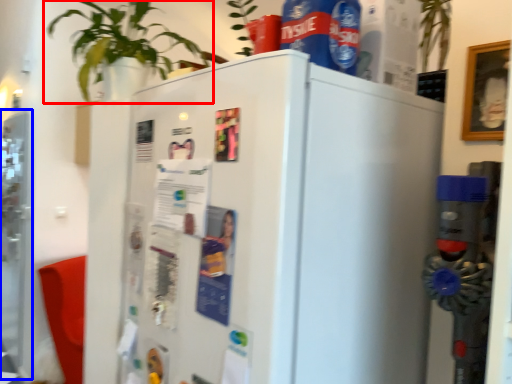
Question: Which of the following is the closest to the observer, houseplant (highlighted by a red box) or screen door (highlighted by a blue box)?

Choices:
 (A) houseplant
 (B) screen door

Answer: (A)